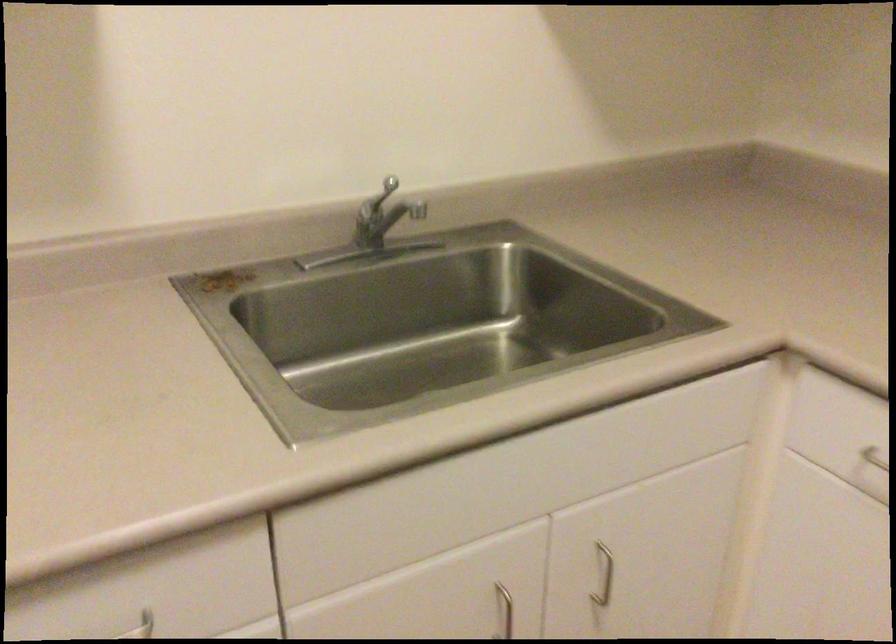
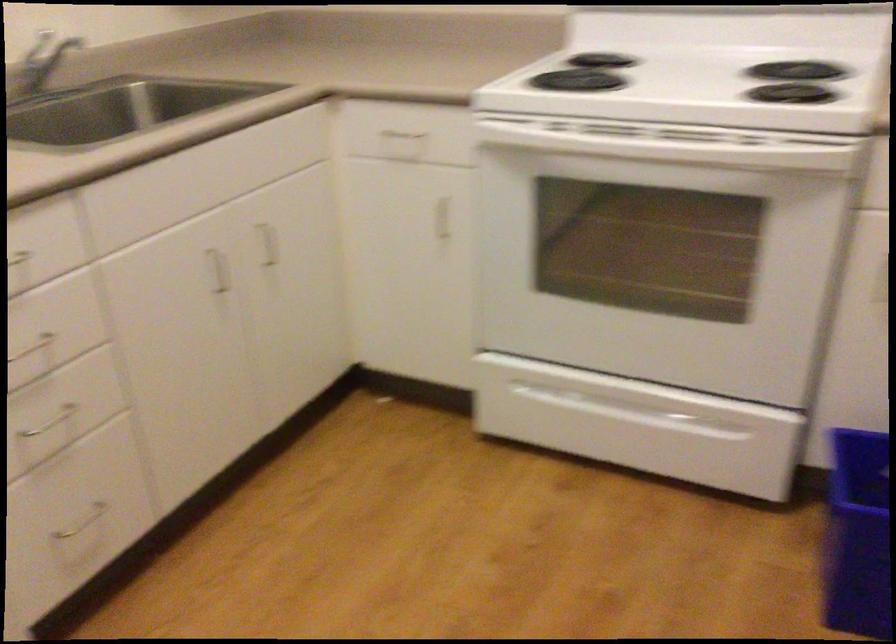
Question: The camera is either moving clockwise (left) or counter-clockwise (right) around the object. The first image is from the beginning of the video and the second image is from the end. Is the camera moving left or right when shooting the video?

Choices:
 (A) Left
 (B) Right

Answer: (A)